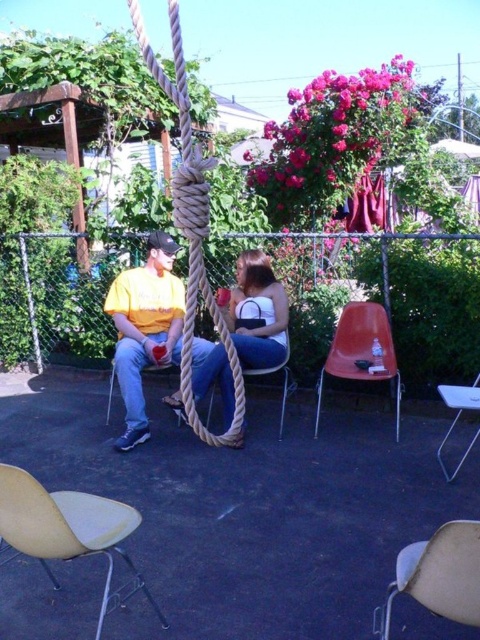
Who is more forward, (133, 376) or (429, 605)?

Point (429, 605)

Can you confirm if yellow matte shirt at center is bigger than beige plastic chair at lower right?

Yes.

Between point (132, 433) and point (477, 568), which one is positioned in front?

Point (477, 568) is more forward.

The height and width of the screenshot is (640, 480). What are the coordinates of `yellow matte shirt at center` in the screenshot? It's located at (144, 328).

Who is shorter, matte white purse at center or white plastic chair at lower right?

With less height is white plastic chair at lower right.

Is point (271, 355) positioned after point (444, 401)?

Yes, point (271, 355) is behind point (444, 401).

What are the coordinates of `matte white purse at center` in the screenshot? It's located at (259, 314).

Can you confirm if light beige plastic chair at lower left is positioned above yellow matte shirt at center?

No, light beige plastic chair at lower left is not above yellow matte shirt at center.

Does point (61, 540) come closer to viewer compared to point (172, 253)?

Yes.

I want to click on light beige plastic chair at lower left, so click(68, 529).